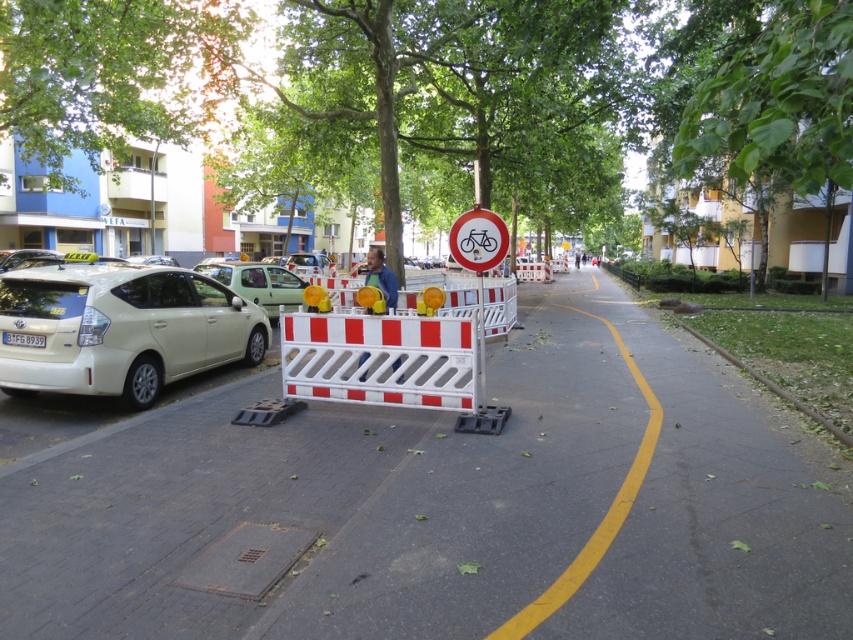
You are a delivery driver who needs to park your truck near the white matte hatchback at left and the white plastic barricade at center. Since your truck is 6 meters long, can you park it between them without overlapping either object?

The white matte hatchback at left is larger than the white plastic barricade at center. However, the exact distance between them isn not specified. Without knowing the spacing between the white matte hatchback at left and the white plastic barricade at center, it is impossible to determine if the 6 meter truck can fit between them.

Looking at the urban street scene, there are two green leafy trees visible. One is labeled as the green leafy tree at center and the other as the green leafy tree at upper center. Which of these two trees is taller?

The green leafy tree at center is much taller than the green leafy tree at upper center.